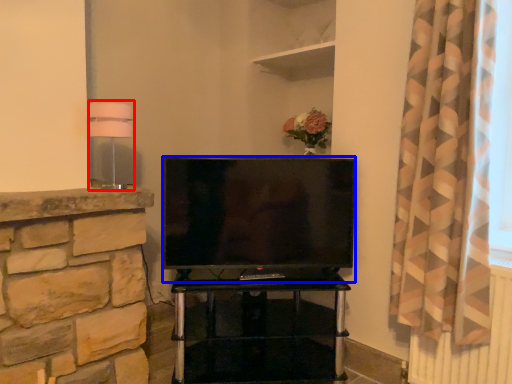
Question: Which of the following is the closest to the observer, lamp (highlighted by a red box) or television (highlighted by a blue box)?

Choices:
 (A) lamp
 (B) television

Answer: (A)